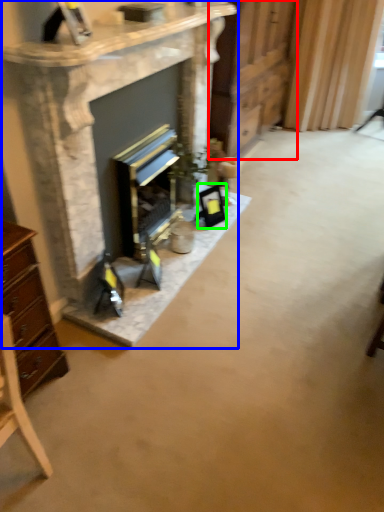
Question: Which object is the closest to the dresser (highlighted by a red box)? Choose among these: fireplace (highlighted by a blue box) or picture frame (highlighted by a green box).

Choices:
 (A) fireplace
 (B) picture frame

Answer: (A)